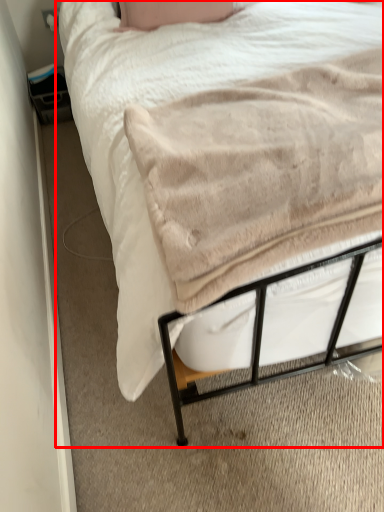
Question: From the image's perspective, what is the correct spatial relationship of bed (annotated by the red box) in relation to blanket?

Choices:
 (A) below
 (B) above

Answer: (B)